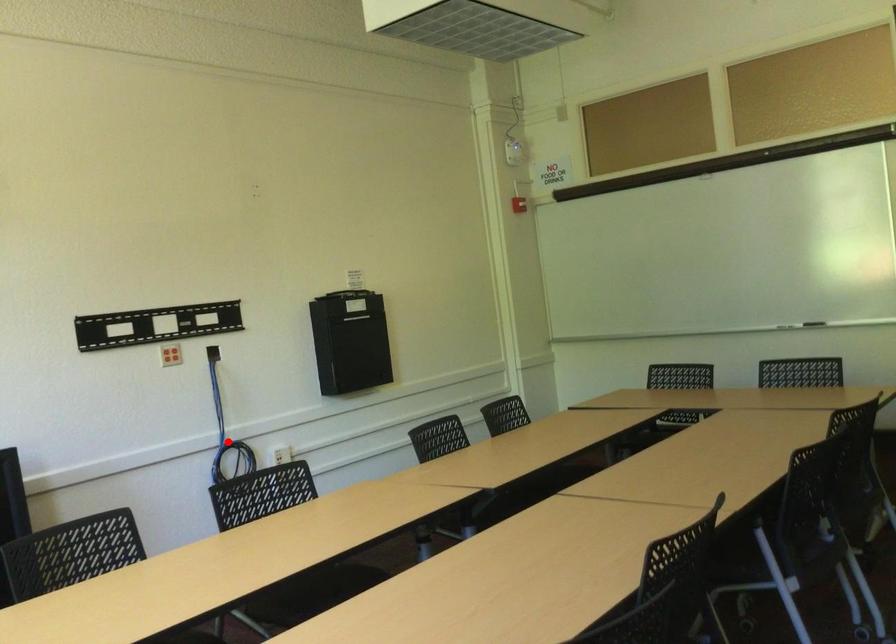
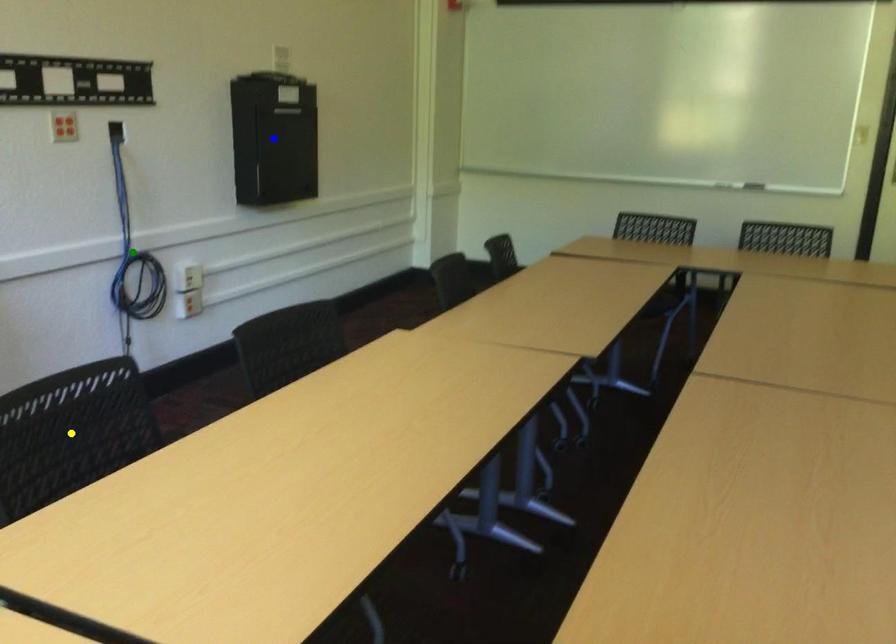
Question: I am providing you with two images of the same scene from different viewpoints. A red point is marked on the first image. You are given multiple points on the second image. In image 2, which mark is for the same physical point as the one in image 1?

Choices:
 (A) yellow point
 (B) green point
 (C) blue point

Answer: (B)